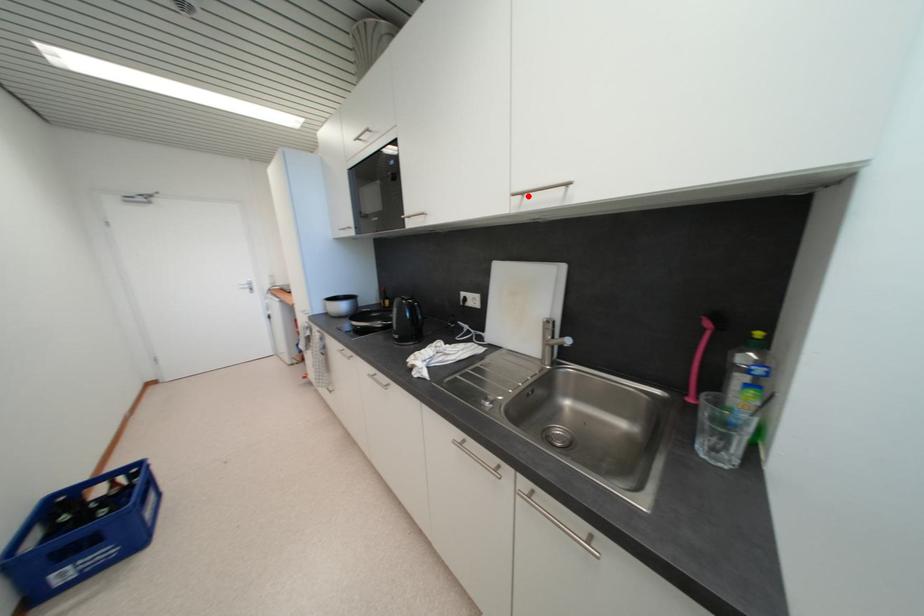
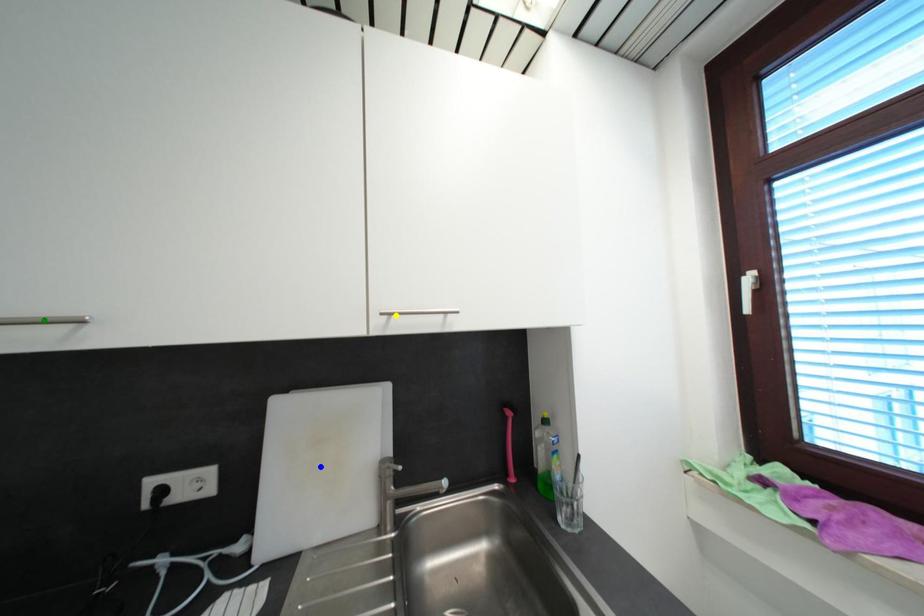
Question: I am providing you with two images of the same scene from different viewpoints. A red point is marked on the first image. You are given multiple points on the second image. Which mark in image 2 goes with the point in image 1?

Choices:
 (A) green point
 (B) yellow point
 (C) blue point

Answer: (B)